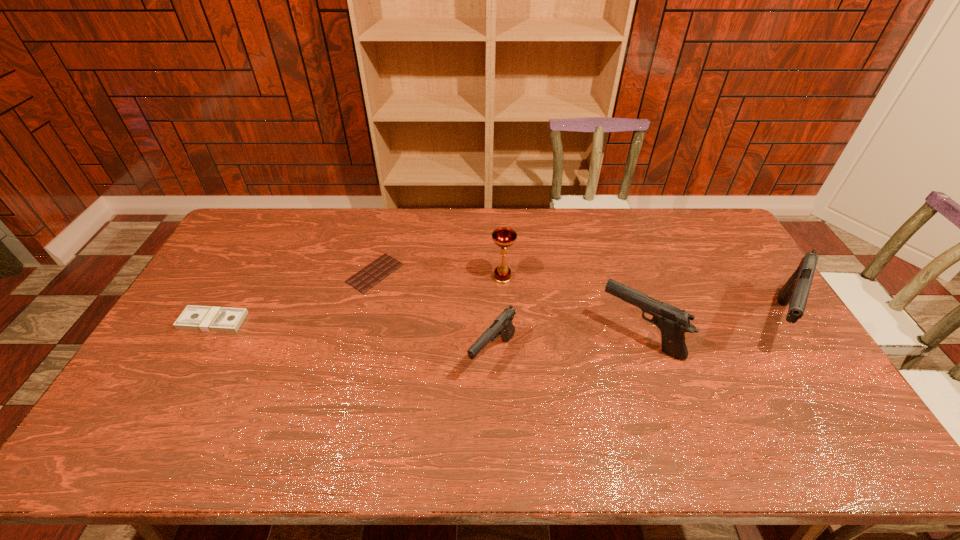
All guns are currently evenly spaced. To continue this pattern, where would you add another gun on the left? Please point out a vacant spot. Please provide its 2D coordinates. Your answer should be formatted as a tuple, i.e. [(x, y)], where the tuple contains the x and y coordinates of a point satisfying the conditions above.

[(336, 373)]